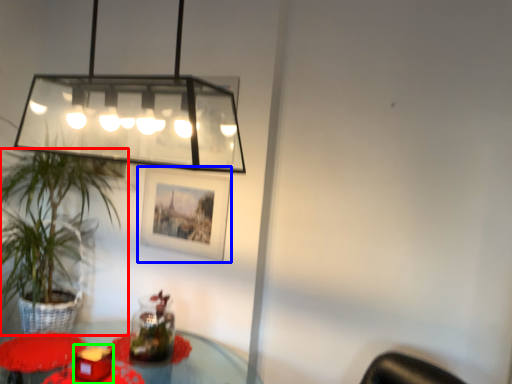
Question: Considering the real-world distances, which object is closest to houseplant (highlighted by a red box)? picture frame (highlighted by a blue box) or candle holder (highlighted by a green box).

Choices:
 (A) picture frame
 (B) candle holder

Answer: (A)